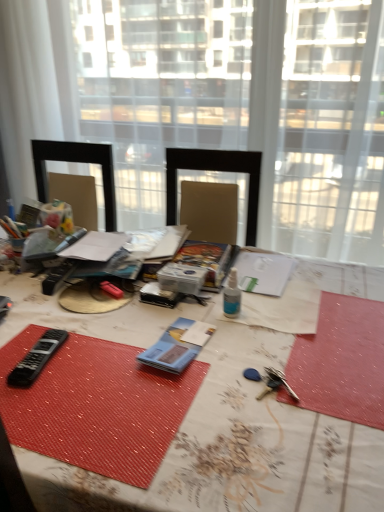
At what (x,y) coordinates should I click in order to perform the action: click on free spot in front of blue paper at center, the first equipment when ordered from right to left. Please return your answer as a coordinate pair (x, y). Looking at the image, I should click on (175, 407).